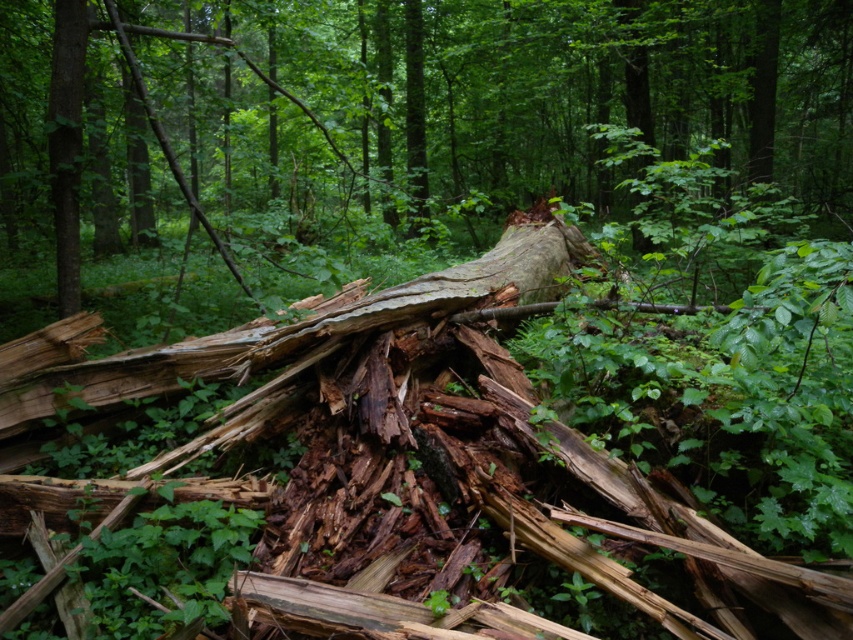
Does point (593, 93) come in front of point (62, 291)?

No, it is not.

Does point (368, 147) lie behind point (73, 131)?

That is True.

Does point (807, 51) come in front of point (85, 38)?

No, (807, 51) is further to viewer.

The image size is (853, 640). What are the coordinates of `rough bark log at center` in the screenshot? It's located at (491, 100).